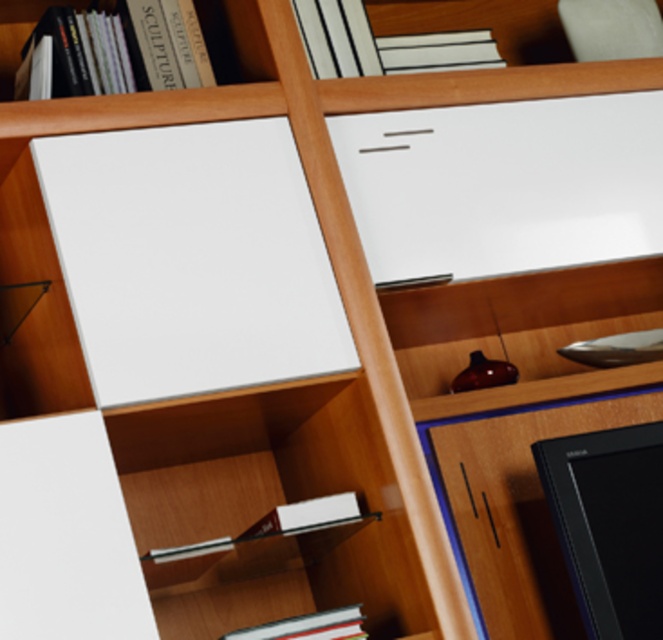
Between point (310, 529) and point (337, 36), which one is positioned in front?

Point (310, 529) is more forward.

Describe the element at coordinates (276, 529) in the screenshot. I see `white glossy book at lower center` at that location.

Between point (192, 547) and point (369, 32), which one is positioned behind?

The point (369, 32) is behind.

In order to click on white glossy book at lower center in this screenshot , I will do `click(276, 529)`.

Is hardcover books at upper left bigger than hardcover book at lower center?

Yes.

Is point (119, 72) positioned after point (310, 625)?

Yes, point (119, 72) is farther from viewer.

Find the location of `hardcover books at upper left`. hardcover books at upper left is located at coordinates (123, 48).

Between point (640, 480) and point (284, 504), which one is positioned in front?

Positioned in front is point (640, 480).

Which is behind, point (605, 486) or point (332, 518)?

Positioned behind is point (605, 486).

Which is in front, point (591, 465) or point (255, 547)?

Positioned in front is point (255, 547).

You are a GUI agent. You are given a task and a screenshot of the screen. Output one action in this format:
    pyautogui.click(x=<x>, y=<y>)
    Task: Click on the black glossy monitor at lower right
    This screenshot has width=663, height=640.
    Given the screenshot: What is the action you would take?
    pyautogui.click(x=609, y=524)